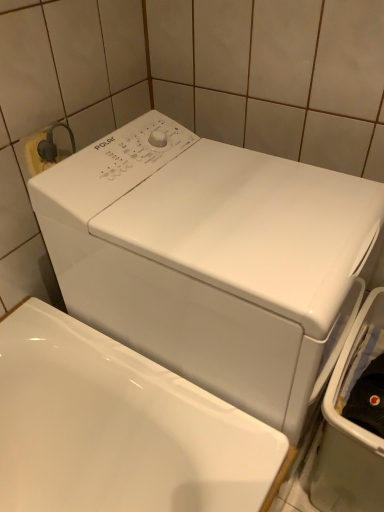
Question: Considering the relative positions of white glossy dishwasher at right and white glossy washing machine at center in the image provided, is white glossy dishwasher at right to the right of white glossy washing machine at center from the viewer's perspective?

Choices:
 (A) yes
 (B) no

Answer: (A)

Question: From the image's perspective, is white glossy dishwasher at right above white glossy washing machine at center?

Choices:
 (A) yes
 (B) no

Answer: (B)

Question: Is white glossy dishwasher at right located outside white glossy washing machine at center?

Choices:
 (A) no
 (B) yes

Answer: (B)

Question: Does white glossy dishwasher at right lie behind white glossy washing machine at center?

Choices:
 (A) no
 (B) yes

Answer: (B)

Question: Considering the relative sizes of white glossy dishwasher at right and white glossy washing machine at center in the image provided, is white glossy dishwasher at right taller than white glossy washing machine at center?

Choices:
 (A) no
 (B) yes

Answer: (A)

Question: Would you say white glossy washing machine at center is part of white glossy dishwasher at right's contents?

Choices:
 (A) yes
 (B) no

Answer: (B)

Question: Is white glossy dishwasher at right surrounded by white glossy washing machine at center?

Choices:
 (A) no
 (B) yes

Answer: (A)

Question: Does white glossy washing machine at center lie behind white glossy dishwasher at right?

Choices:
 (A) yes
 (B) no

Answer: (B)

Question: Is white glossy washing machine at center touching white glossy dishwasher at right?

Choices:
 (A) no
 (B) yes

Answer: (A)

Question: Would you say white glossy washing machine at center is a long distance from white glossy dishwasher at right?

Choices:
 (A) yes
 (B) no

Answer: (B)

Question: Can you confirm if white glossy washing machine at center is bigger than white glossy dishwasher at right?

Choices:
 (A) no
 (B) yes

Answer: (B)

Question: Is white glossy dishwasher at right at the back of white glossy washing machine at center?

Choices:
 (A) no
 (B) yes

Answer: (A)

Question: Considering the positions of white glossy dishwasher at right and white glossy washing machine at center in the image, is white glossy dishwasher at right wider or thinner than white glossy washing machine at center?

Choices:
 (A) thin
 (B) wide

Answer: (A)